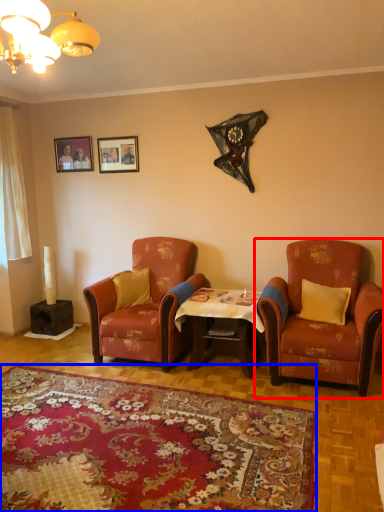
Question: Which object appears closest to the camera in this image, chair (highlighted by a red box) or plain (highlighted by a blue box)?

Choices:
 (A) chair
 (B) plain

Answer: (B)